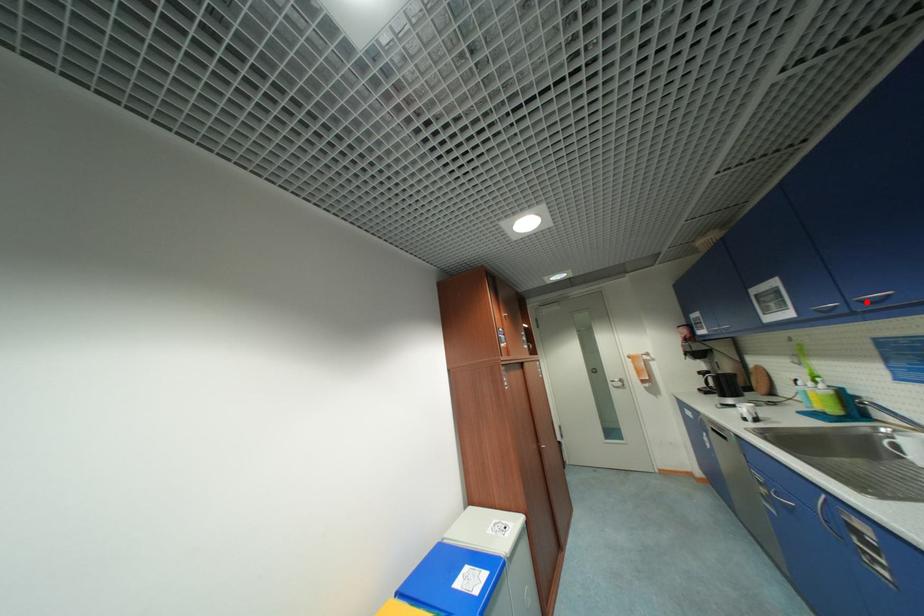
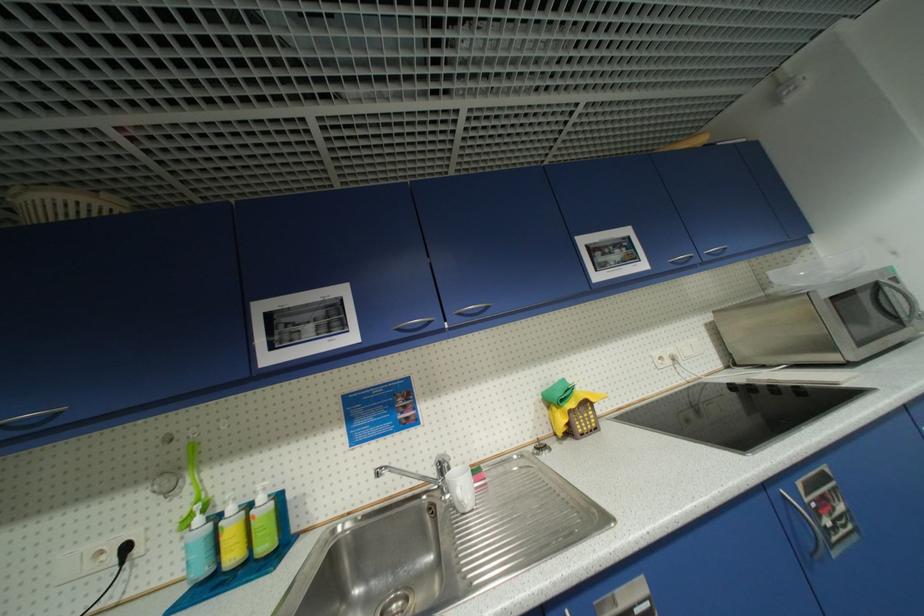
Where in the second image is the point corresponding to the highlighted location from the first image?

(466, 315)